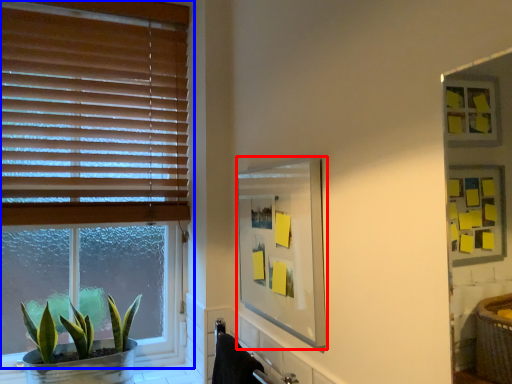
Question: Which object appears closest to the camera in this image, mirror (highlighted by a red box) or window (highlighted by a blue box)?

Choices:
 (A) mirror
 (B) window

Answer: (A)